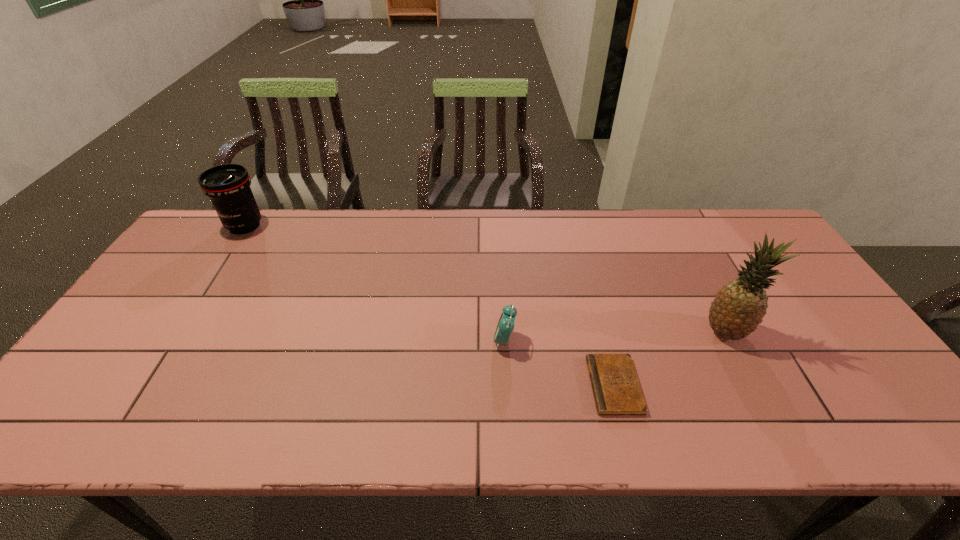
Where is `free space between the second shortest object and the rightmost object`? This screenshot has height=540, width=960. free space between the second shortest object and the rightmost object is located at coordinates (614, 336).

Identify the location of free space between the pineapple and the third shortest object. (485, 279).

Locate an element on the screen. This screenshot has height=540, width=960. empty space between the pineapple and the second tallest object is located at coordinates (485, 279).

The width and height of the screenshot is (960, 540). What are the coordinates of `empty space between the third tallest object and the shortest object` in the screenshot? It's located at (560, 363).

What are the coordinates of `vacant space in between the diary and the third object from right to left` in the screenshot? It's located at (560, 363).

Select which object is the second closest to the second object from left to right. Please provide its 2D coordinates. Your answer should be formatted as a tuple, i.e. [(x, y)], where the tuple contains the x and y coordinates of a point satisfying the conditions above.

[(739, 307)]

In order to click on object that is the third nearest to the farthest object in this screenshot , I will do `click(739, 307)`.

At what (x,y) coordinates should I click in order to perform the action: click on vacant space that satisfies the following two spatial constraints: 1. on the front side of the pineapple; 2. on the face of the third tallest object. Please return your answer as a coordinate pair (x, y). This screenshot has width=960, height=540. Looking at the image, I should click on (730, 341).

The height and width of the screenshot is (540, 960). Find the location of `blank area in the image that satisfies the following two spatial constraints: 1. on the front side of the pineapple; 2. on the face of the second object from left to right`. blank area in the image that satisfies the following two spatial constraints: 1. on the front side of the pineapple; 2. on the face of the second object from left to right is located at coordinates (730, 341).